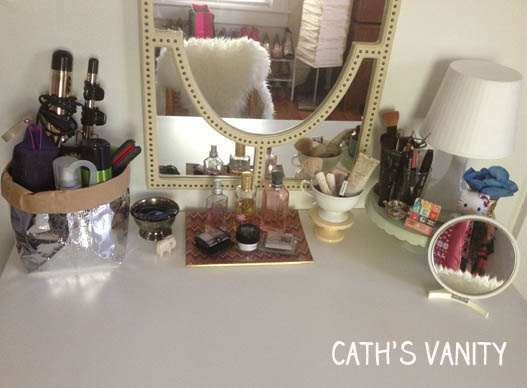
You are a GUI agent. You are given a task and a screenshot of the screen. Output one action in this format:
    pyautogui.click(x=<x>, y=<y>)
    Task: Click on the wall
    
    Given the screenshot: What is the action you would take?
    pyautogui.click(x=92, y=35), pyautogui.click(x=487, y=28)